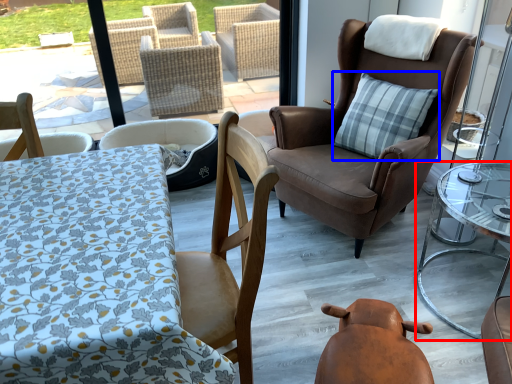
Question: Which of the following is the farthest to the observer, table (highlighted by a red box) or pillow (highlighted by a blue box)?

Choices:
 (A) table
 (B) pillow

Answer: (B)